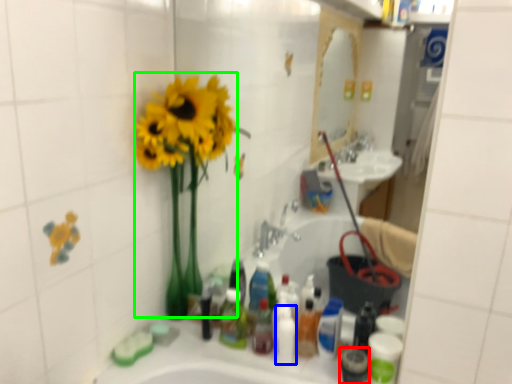
Question: Considering the real-world distances, which object is farthest from mouthwash (highlighted by a red box)? toiletry (highlighted by a blue box) or floral arrangement (highlighted by a green box)?

Choices:
 (A) toiletry
 (B) floral arrangement

Answer: (B)